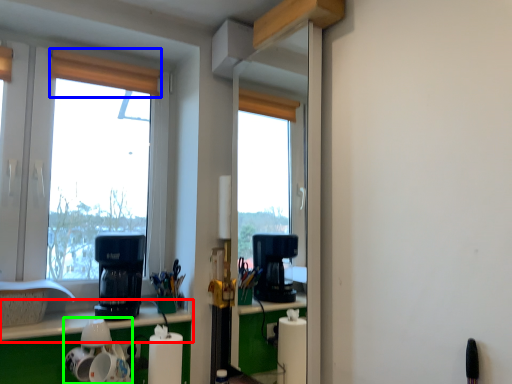
Question: Estimate the real-world distances between objects in this image. Which object is closer to counter top (highlighted by a red box), curtain (highlighted by a blue box) or appliance (highlighted by a green box)?

Choices:
 (A) curtain
 (B) appliance

Answer: (B)